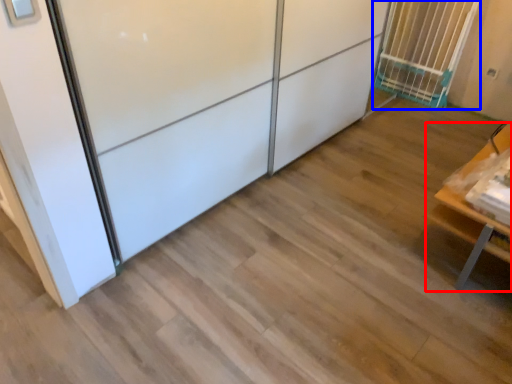
Question: Among these objects, which one is nearest to the camera, furniture (highlighted by a red box) or cage (highlighted by a blue box)?

Choices:
 (A) furniture
 (B) cage

Answer: (A)